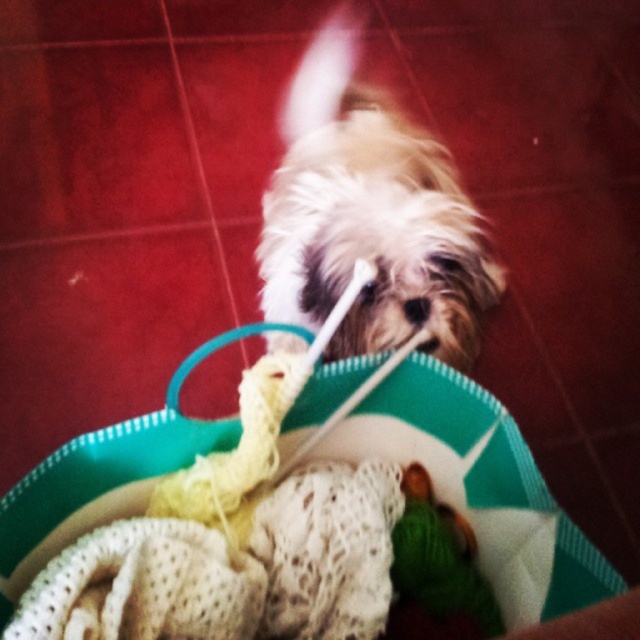
You are a photographer trying to capture the small dog holding the toothbrush. You notice two points in the scene at coordinates point (307,138) and point (444,566). Which point is closer to your camera lens?

Point (307,138) is further to the viewer than point (444,566), so the point closer to the camera lens is point (444,566).

You are a pet owner who wants to place the white knitted blanket at center and the green fabric toy at center into the basket. Based on their positions in the image, which item is closer to the top of the basket?

The white knitted blanket at center is above the green fabric toy at center, so it is closer to the top of the basket.